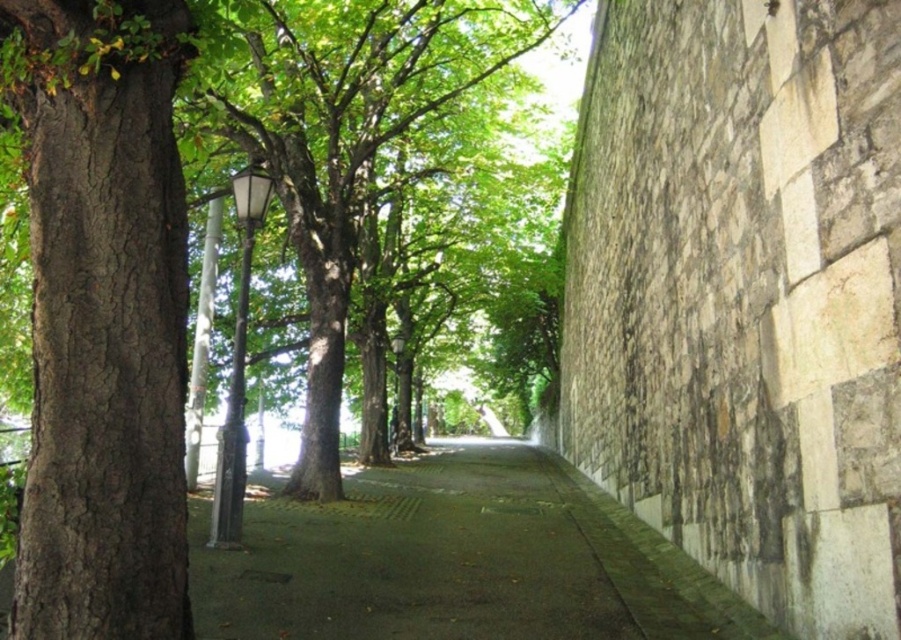
Measure the distance from brown rough bark tree at left to green concrete pavement at center.

brown rough bark tree at left is 12.86 feet from green concrete pavement at center.

Can you confirm if brown rough bark tree at left is thinner than green concrete pavement at center?

Yes, brown rough bark tree at left is thinner than green concrete pavement at center.

Does point (120, 428) come in front of point (476, 502)?

That is True.

Identify the location of brown rough bark tree at left. (102, 317).

Which is below, brown rough bark tree at left or green leafy tree at center?

brown rough bark tree at left is lower down.

What do you see at coordinates (102, 317) in the screenshot? The height and width of the screenshot is (640, 901). I see `brown rough bark tree at left` at bounding box center [102, 317].

Is point (55, 74) less distant than point (225, 134)?

Yes, it is in front of point (225, 134).

At what (x,y) coordinates should I click in order to perform the action: click on brown rough bark tree at left. Please return your answer as a coordinate pair (x, y). This screenshot has height=640, width=901. Looking at the image, I should click on (102, 317).

Looking at this image, can you confirm if green concrete pavement at center is positioned above green leafy tree at center?

Incorrect, green concrete pavement at center is not positioned above green leafy tree at center.

Is green concrete pavement at center taller than green leafy tree at center?

Yes.

Find the location of a particular element. This screenshot has height=640, width=901. green concrete pavement at center is located at coordinates (457, 560).